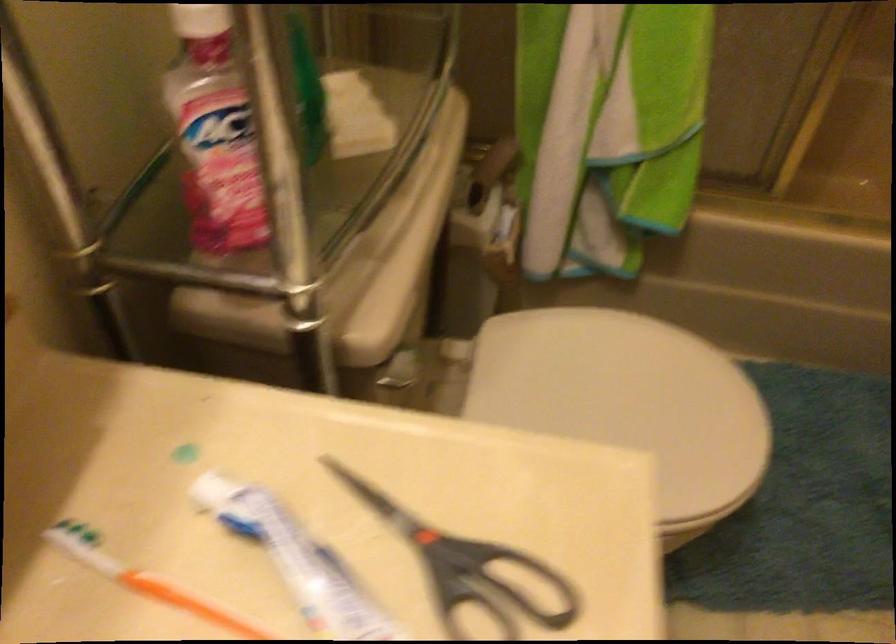
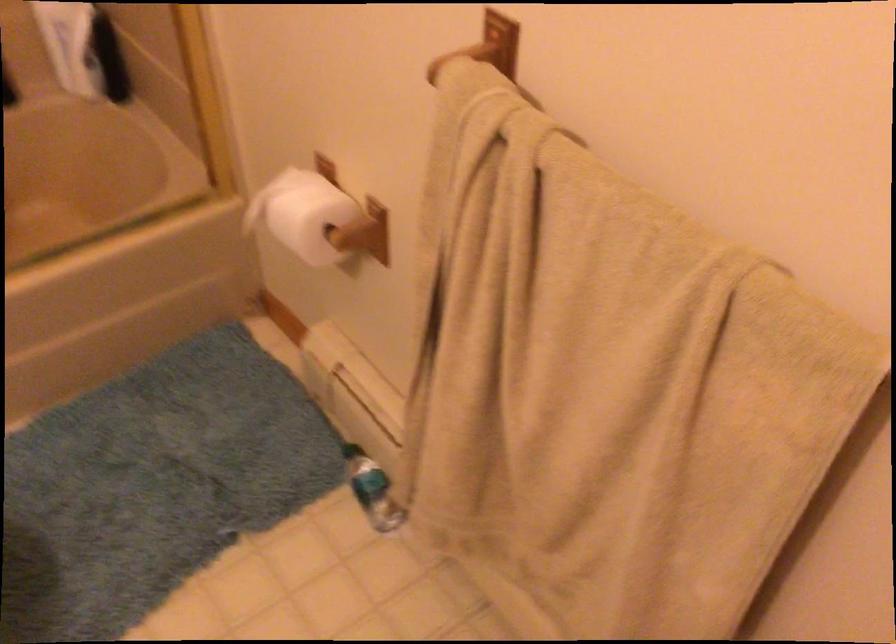
Question: Based on the continuous images, in which direction is the camera rotating? Reply with the corresponding letter.

Choices:
 (A) Left
 (B) Right
 (C) Up
 (D) Down

Answer: (B)